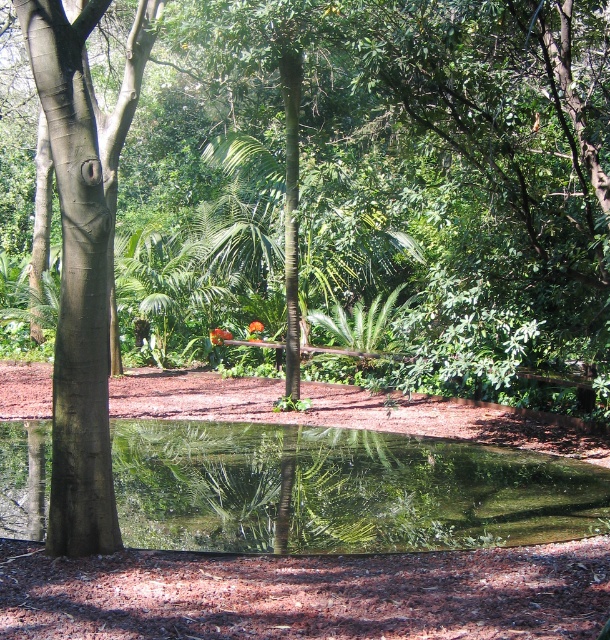
Who is more forward, (184, 465) or (92, 205)?

Point (92, 205) is more forward.

The width and height of the screenshot is (610, 640). In order to click on transparent glass puddle at center in this screenshot , I will do `click(340, 490)`.

Who is more forward, (265, 435) or (104, 253)?

Positioned in front is point (104, 253).

Image resolution: width=610 pixels, height=640 pixels. What are the coordinates of `transparent glass puddle at center` in the screenshot? It's located at (340, 490).